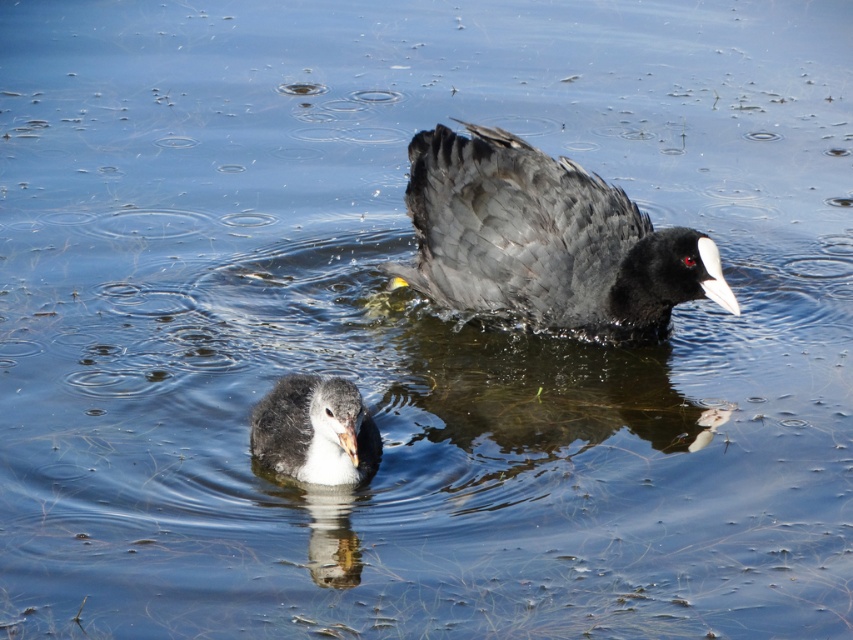
Measure the distance between matte black duck at center and gray downy duckling at center.

A distance of 33.72 inches exists between matte black duck at center and gray downy duckling at center.

Is point (546, 163) closer to camera compared to point (367, 472)?

No, (546, 163) is further to viewer.

Is point (639, 282) positioned behind point (361, 410)?

Yes, point (639, 282) is farther from viewer.

At what (x,y) coordinates should I click in order to perform the action: click on matte black duck at center. Please return your answer as a coordinate pair (x, y). Looking at the image, I should click on (544, 241).